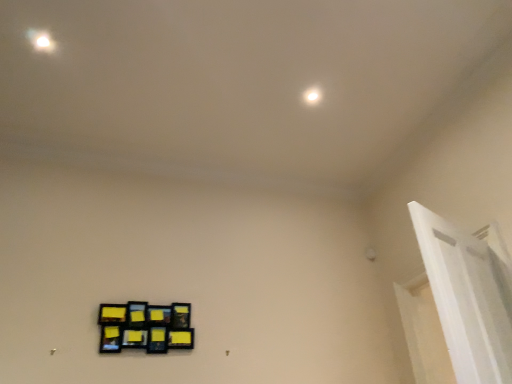
Describe the element at coordinates (312, 95) in the screenshot. The image size is (512, 384). I see `white glossy light at upper center` at that location.

Where is `white glossy door frame at upper right`? white glossy door frame at upper right is located at coordinates (468, 297).

Between white glossy light at upper center and white glossy door frame at upper right, which one has more height?

Standing taller between the two is white glossy door frame at upper right.

Based on the photo, from a real-world perspective, which object rests below the other?

In real-world perspective, white glossy door frame at upper right is lower.

Can you confirm if white glossy light at upper center is thinner than white glossy door frame at upper right?

Answer: Indeed, white glossy light at upper center has a lesser width compared to white glossy door frame at upper right.

From the image's perspective, does white glossy light at upper center appear higher than white glossy door frame at upper right?

Yes, from the image's perspective, white glossy light at upper center is on top of white glossy door frame at upper right.

From the image's perspective, which is below, black matte picture frame at lower left or white glossy door frame at upper right?

black matte picture frame at lower left appears lower in the image.

In the scene shown: Is black matte picture frame at lower left oriented towards white glossy door frame at upper right?

No, black matte picture frame at lower left is not aimed at white glossy door frame at upper right.

Is black matte picture frame at lower left inside or outside of white glossy door frame at upper right?

black matte picture frame at lower left lies outside white glossy door frame at upper right.

From a real-world perspective, is black matte picture frame at lower left positioned under white glossy door frame at upper right based on gravity?

No, from a real-world perspective, black matte picture frame at lower left is not beneath white glossy door frame at upper right.

Is white glossy door frame at upper right positioned with its back to white glossy light at upper center?

No.

Considering the sizes of objects white glossy door frame at upper right and white glossy light at upper center in the image provided, who is shorter, white glossy door frame at upper right or white glossy light at upper center?

white glossy light at upper center.

Is white glossy door frame at upper right bigger than white glossy light at upper center?

Indeed, white glossy door frame at upper right has a larger size compared to white glossy light at upper center.

Looking at this image, from a real-world perspective, is white glossy light at upper center located higher than black matte picture frame at lower left?

Indeed, from a real-world perspective, white glossy light at upper center stands above black matte picture frame at lower left.

Consider the image. Considering the relative positions of white glossy light at upper center and black matte picture frame at lower left in the image provided, is white glossy light at upper center to the left of black matte picture frame at lower left from the viewer's perspective?

No, white glossy light at upper center is not to the left of black matte picture frame at lower left.

Is the surface of white glossy light at upper center in direct contact with black matte picture frame at lower left?

No, white glossy light at upper center is not making contact with black matte picture frame at lower left.

Is white glossy light at upper center outside of black matte picture frame at lower left?

Yes, white glossy light at upper center is not within black matte picture frame at lower left.

Based on their positions, is black matte picture frame at lower left located to the left or right of white glossy light at upper center?

black matte picture frame at lower left is positioned on white glossy light at upper center's left side.

Which is nearer, [177,323] or [306,99]?

Point [177,323] is positioned closer to the camera compared to point [306,99].

Does black matte picture frame at lower left turn towards white glossy light at upper center?

No, black matte picture frame at lower left is not aimed at white glossy light at upper center.

Does black matte picture frame at lower left have a greater height compared to white glossy light at upper center?

Yes, black matte picture frame at lower left is taller than white glossy light at upper center.

From a real-world perspective, which is physically below, white glossy door frame at upper right or black matte picture frame at lower left?

white glossy door frame at upper right.

Is white glossy door frame at upper right taller or shorter than black matte picture frame at lower left?

Clearly, white glossy door frame at upper right is taller compared to black matte picture frame at lower left.

Is white glossy door frame at upper right positioned before black matte picture frame at lower left?

Yes, white glossy door frame at upper right is in front of black matte picture frame at lower left.

Is white glossy door frame at upper right facing away from black matte picture frame at lower left?

That's not correct — white glossy door frame at upper right is not looking away from black matte picture frame at lower left.

I want to click on dot on the left of the white glossy door frame at upper right, so click(312, 95).

Find the location of a particular element. The image size is (512, 384). window frame lying above the black matte picture frame at lower left (from the image's perspective) is located at coordinates (468, 297).

Estimate the real-world distances between objects in this image. Which object is further from black matte picture frame at lower left, white glossy light at upper center or white glossy door frame at upper right?

Among the two, white glossy light at upper center is located further to black matte picture frame at lower left.

From the image, which object appears to be nearer to white glossy light at upper center, black matte picture frame at lower left or white glossy door frame at upper right?

white glossy door frame at upper right is closer to white glossy light at upper center.

Based on their spatial positions, is white glossy light at upper center or black matte picture frame at lower left further from white glossy door frame at upper right?

Among the two, black matte picture frame at lower left is located further to white glossy door frame at upper right.

Based on their spatial positions, is black matte picture frame at lower left or white glossy light at upper center closer to white glossy door frame at upper right?

white glossy light at upper center lies closer to white glossy door frame at upper right than the other object.

Based on their spatial positions, is white glossy door frame at upper right or black matte picture frame at lower left closer to white glossy light at upper center?

The object closer to white glossy light at upper center is white glossy door frame at upper right.

Consider the image. Looking at the image, which one is located further to black matte picture frame at lower left, white glossy door frame at upper right or white glossy light at upper center?

white glossy light at upper center.

Image resolution: width=512 pixels, height=384 pixels. Identify the location of dot between black matte picture frame at lower left and white glossy door frame at upper right from left to right. (312, 95).